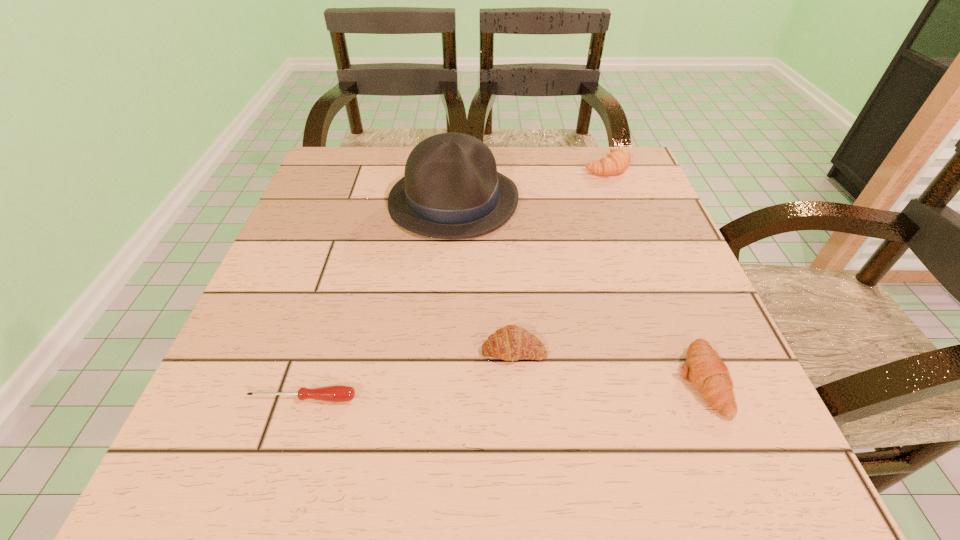
Where is `free spot between the screwdriver and the fourth shortest object`? free spot between the screwdriver and the fourth shortest object is located at coordinates (454, 282).

This screenshot has height=540, width=960. Find the location of `vacant area between the leftmost crescent roll and the screwdriver`. vacant area between the leftmost crescent roll and the screwdriver is located at coordinates (408, 374).

Locate an element on the screen. The image size is (960, 540). free area in between the tallest crescent roll and the tallest object is located at coordinates (530, 184).

Where is `unoccupied area between the shortest object and the bowler hat`? unoccupied area between the shortest object and the bowler hat is located at coordinates (378, 300).

At what (x,y) coordinates should I click in order to perform the action: click on empty space between the second tallest object and the shortest object. Please return your answer as a coordinate pair (x, y). Looking at the image, I should click on (454, 282).

You are a GUI agent. You are given a task and a screenshot of the screen. Output one action in this format:
    pyautogui.click(x=<x>, y=<y>)
    Task: Click on the object identified as the closest to the leftmost crescent roll
    The height and width of the screenshot is (540, 960).
    Given the screenshot: What is the action you would take?
    pyautogui.click(x=337, y=393)

Image resolution: width=960 pixels, height=540 pixels. Find the location of `object that ranks as the fourth closest to the tallest object`. object that ranks as the fourth closest to the tallest object is located at coordinates (337, 393).

Locate which crescent roll ranks in proximity to the leftmost crescent roll. Please provide its 2D coordinates. Your answer should be formatted as a tuple, i.e. [(x, y)], where the tuple contains the x and y coordinates of a point satisfying the conditions above.

[(704, 368)]

I want to click on crescent roll that can be found as the closest to the leftmost crescent roll, so click(x=704, y=368).